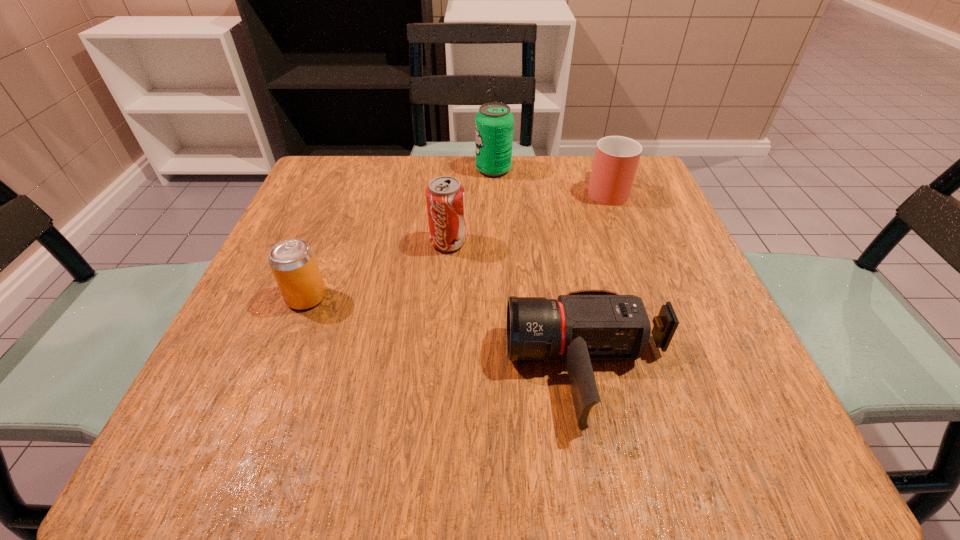
The image size is (960, 540). Identify the location of cup situated at the right edge. (616, 160).

This screenshot has width=960, height=540. I want to click on camcorder present at the right edge, so click(x=584, y=325).

The image size is (960, 540). Find the location of `object at the far right corner`. object at the far right corner is located at coordinates pos(616,160).

Image resolution: width=960 pixels, height=540 pixels. I want to click on object that is positioned at the near right corner, so click(x=584, y=325).

This screenshot has width=960, height=540. In order to click on vacant region at the far edge of the desktop in this screenshot , I will do `click(440, 164)`.

I want to click on free region at the near edge of the desktop, so click(639, 442).

In the image, there is a desktop. Identify the location of free space at the left edge. This screenshot has width=960, height=540. (316, 253).

Find the location of a particular element. This screenshot has width=960, height=540. free space at the right edge of the desktop is located at coordinates (669, 300).

At what (x,y) coordinates should I click in order to perform the action: click on free space at the far left corner. Please return your answer as a coordinate pair (x, y). Image resolution: width=960 pixels, height=540 pixels. Looking at the image, I should click on (330, 169).

Identify the location of vacant region at the far right corner of the desktop. (646, 211).